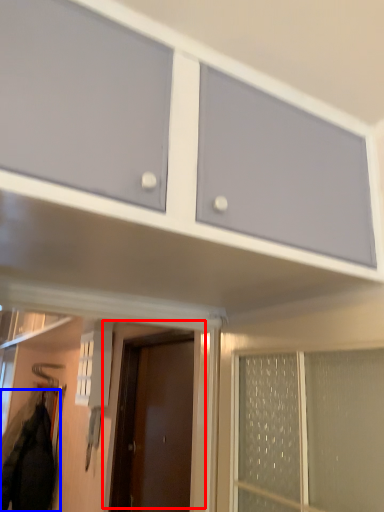
Question: Which of the following is the closest to the observer, door (highlighted by a red box) or jacket (highlighted by a blue box)?

Choices:
 (A) door
 (B) jacket

Answer: (A)